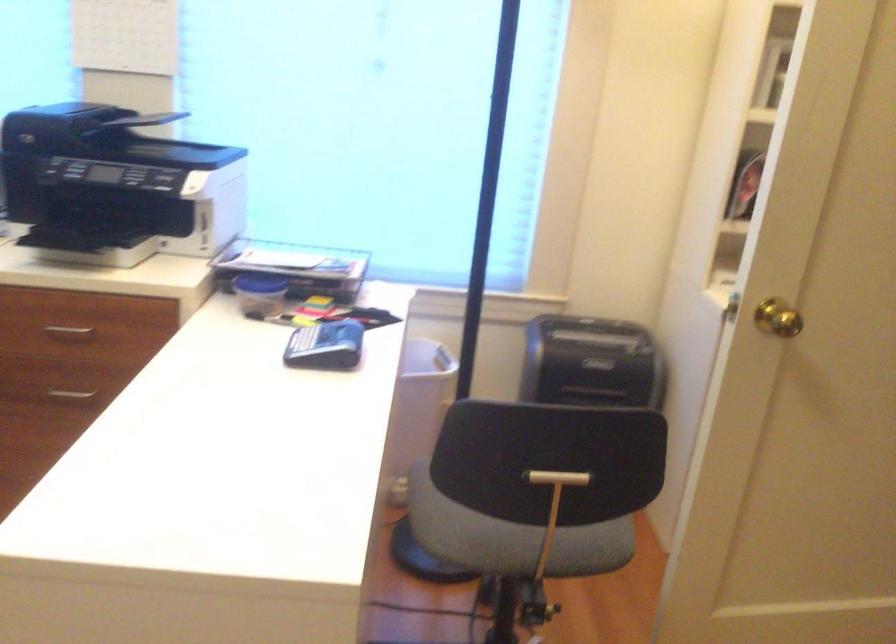
You are a GUI agent. You are given a task and a screenshot of the screen. Output one action in this format:
    pyautogui.click(x=<x>, y=<y>)
    Task: Click on the gold door handle
    This screenshot has width=896, height=644.
    Given the screenshot: What is the action you would take?
    pyautogui.click(x=778, y=317)